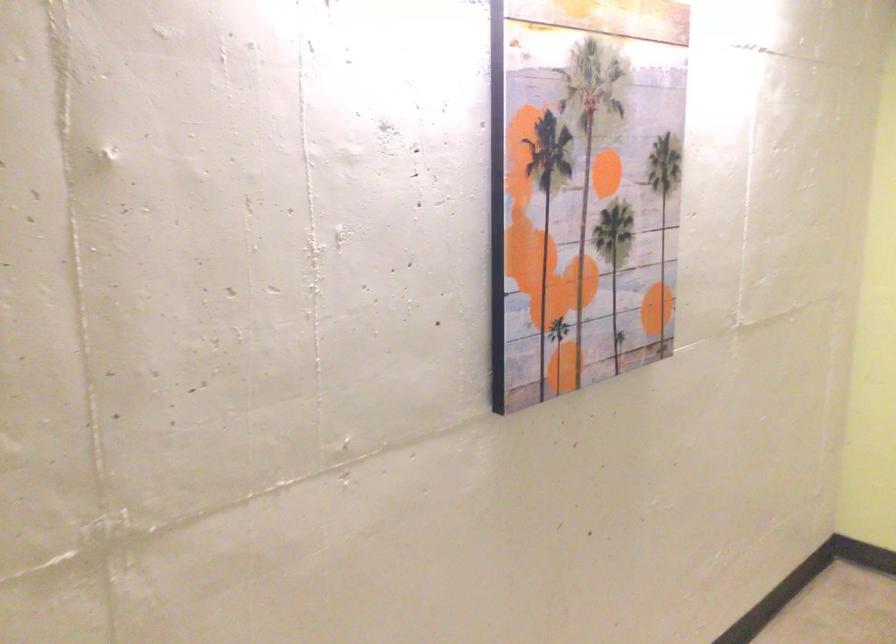
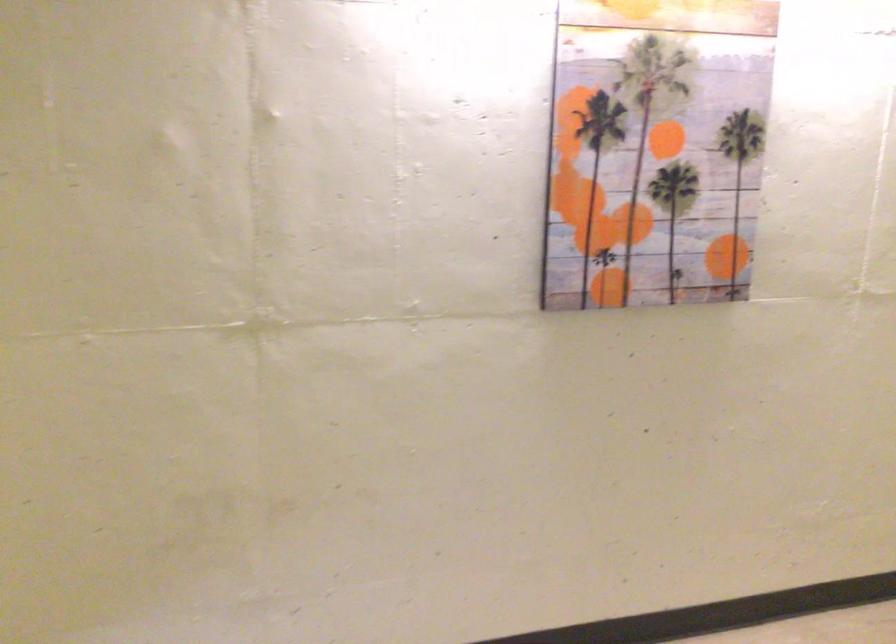
Find the pixel in the second image that matches point 597,185 in the first image.

(655, 149)